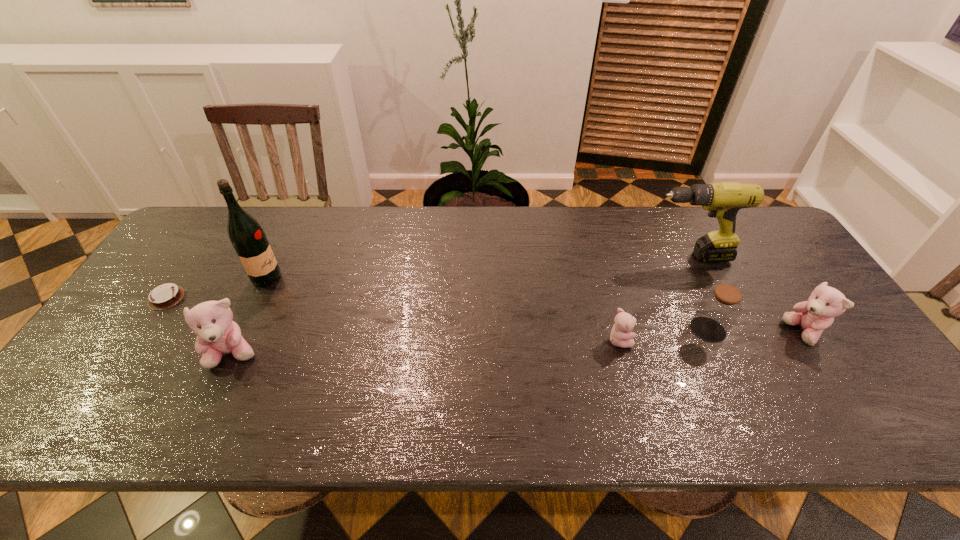
Select which object appears as the third closest to the liquor. Please provide its 2D coordinates. Your answer should be formatted as a tuple, i.e. [(x, y)], where the tuple contains the x and y coordinates of a point satisfying the conditions above.

[(621, 336)]

Locate which object is the sixth closest to the leftmost teddy bear. Please provide its 2D coordinates. Your answer should be formatted as a tuple, i.e. [(x, y)], where the tuple contains the x and y coordinates of a point satisfying the conditions above.

[(813, 316)]

This screenshot has height=540, width=960. I want to click on teddy bear that is the third closest to the tallest object, so click(813, 316).

You are a GUI agent. You are given a task and a screenshot of the screen. Output one action in this format:
    pyautogui.click(x=<x>, y=<y>)
    Task: Click on the teddy bear that is the closest to the fourth object from left to right
    
    Given the screenshot: What is the action you would take?
    pyautogui.click(x=813, y=316)

Locate an element on the screen. This screenshot has width=960, height=540. free space that satisfies the following two spatial constraints: 1. at the face of the shortest teddy bear; 2. at the face of the leftmost teddy bear is located at coordinates (623, 355).